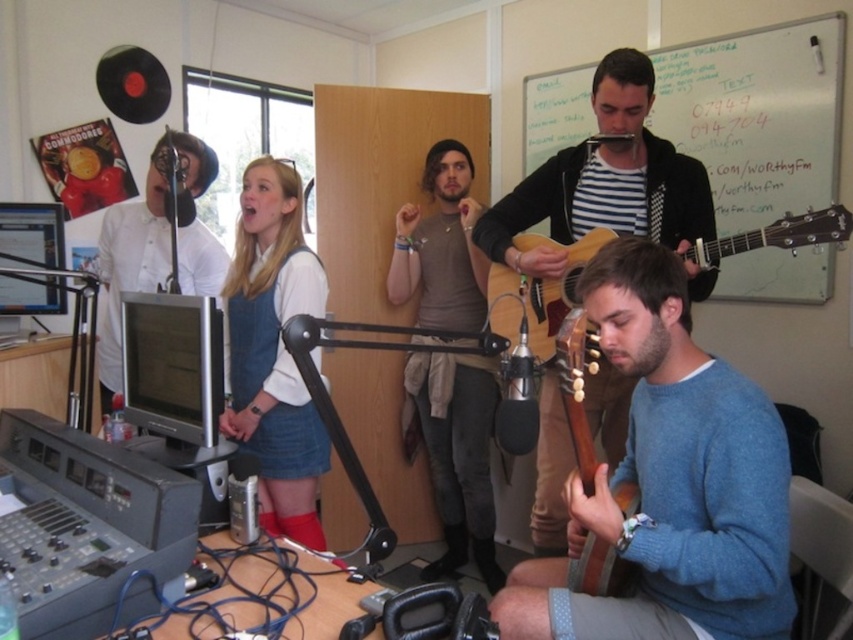
Does whiteboard at upper center appear on the left side of white glossy microphone at left?

In fact, whiteboard at upper center is to the right of white glossy microphone at left.

Does whiteboard at upper center have a greater width compared to white glossy microphone at left?

Yes, whiteboard at upper center is wider than white glossy microphone at left.

Which is in front, point (706, 65) or point (144, 288)?

Point (144, 288) is more forward.

Find the location of a particular element. The image size is (853, 640). whiteboard at upper center is located at coordinates (757, 115).

Is whiteboard at upper center smaller than light brown wooden guitar at lower right?

Indeed, whiteboard at upper center has a smaller size compared to light brown wooden guitar at lower right.

Identify the location of whiteboard at upper center. (757, 115).

Is matte black guitar at center to the right of white glossy microphone at left from the viewer's perspective?

Correct, you'll find matte black guitar at center to the right of white glossy microphone at left.

Does matte black guitar at center appear on the left side of white glossy microphone at left?

No, matte black guitar at center is not to the left of white glossy microphone at left.

Measure the distance between matte black guitar at center and camera.

matte black guitar at center and camera are 6.29 feet apart from each other.

Where is `matte black guitar at center`? The image size is (853, 640). matte black guitar at center is located at coordinates (604, 180).